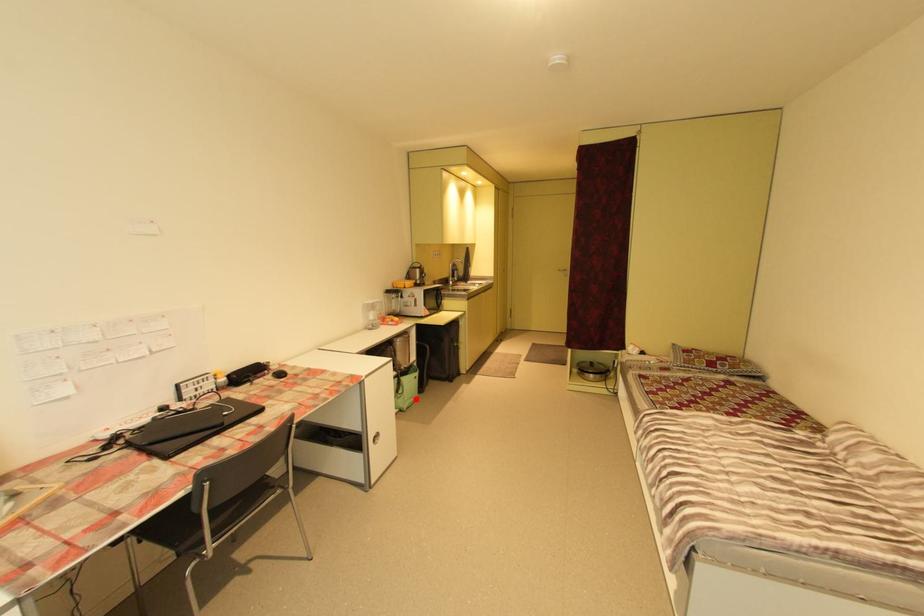
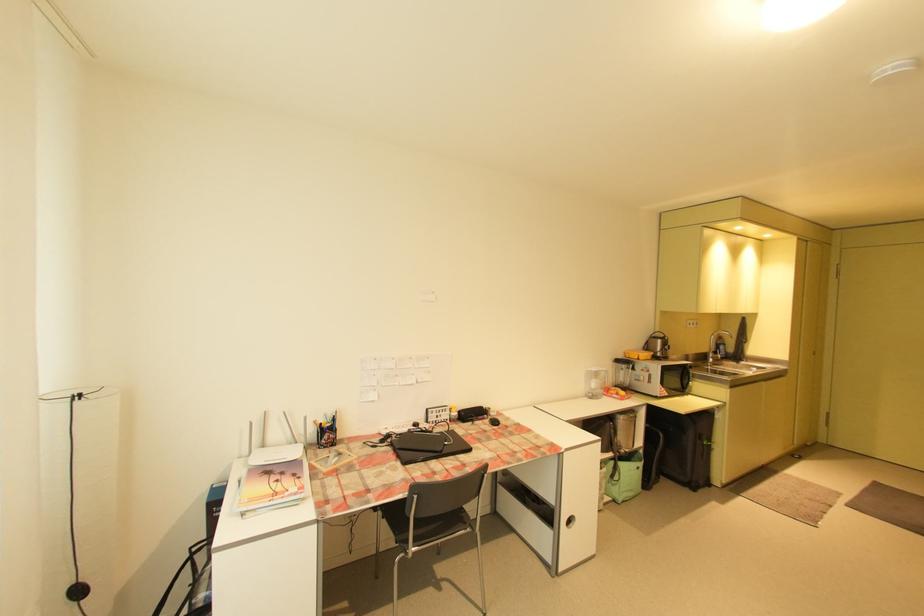
Question: I am providing you with two images of the same scene from different viewpoints. A red point is shown in image1. For the corresponding object point in image2, is it positioned nearer or farther from the camera?

Choices:
 (A) Nearer
 (B) Farther

Answer: (B)